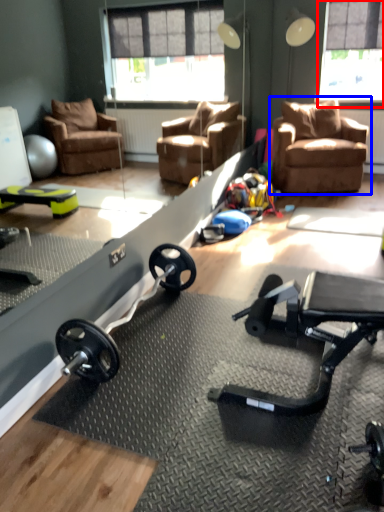
Question: Which point is closer to the camera, window screen (highlighted by a red box) or chair (highlighted by a blue box)?

Choices:
 (A) window screen
 (B) chair

Answer: (B)